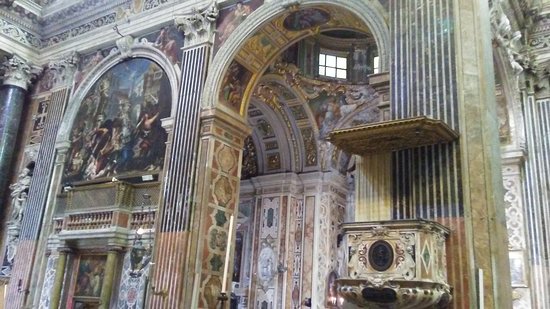
Identify the location of window. The width and height of the screenshot is (550, 309). [x=324, y=73].